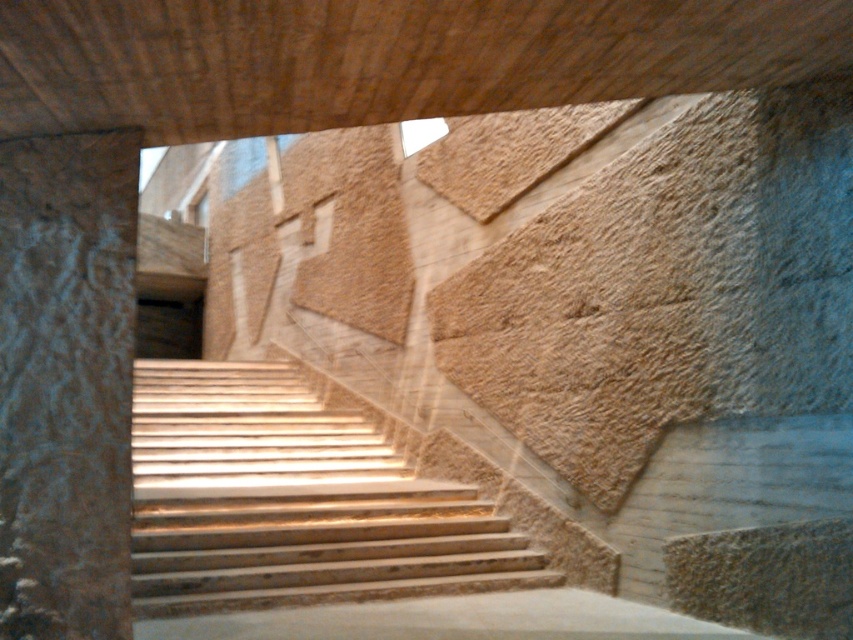
Can you confirm if light brown wooden stairs at center is positioned to the left of rough stone pillar at left?

No, light brown wooden stairs at center is not to the left of rough stone pillar at left.

Which of these two, light brown wooden stairs at center or rough stone pillar at left, stands shorter?

light brown wooden stairs at center

Is point (265, 452) positioned behind point (0, 540)?

Yes, point (265, 452) is behind point (0, 540).

Where is `light brown wooden stairs at center`? light brown wooden stairs at center is located at coordinates (293, 500).